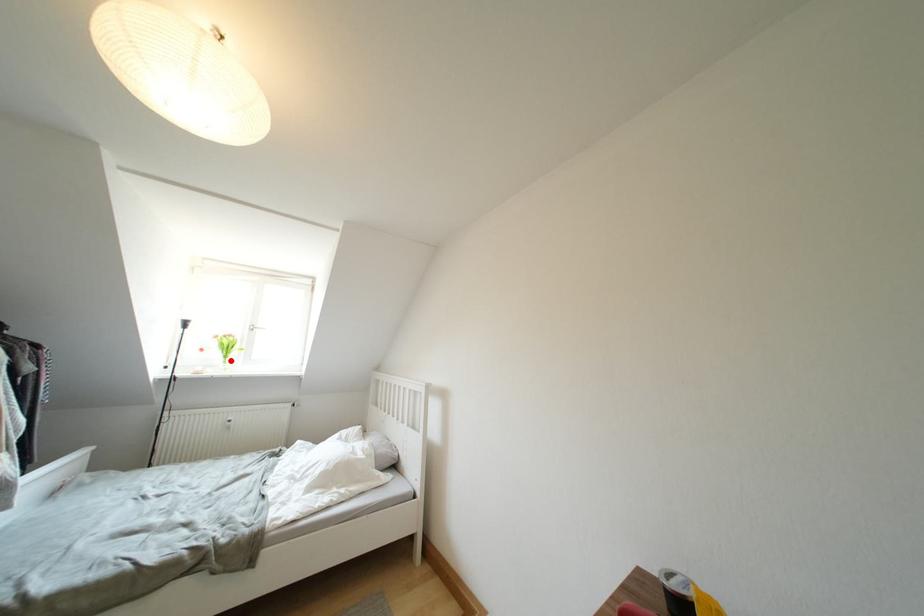
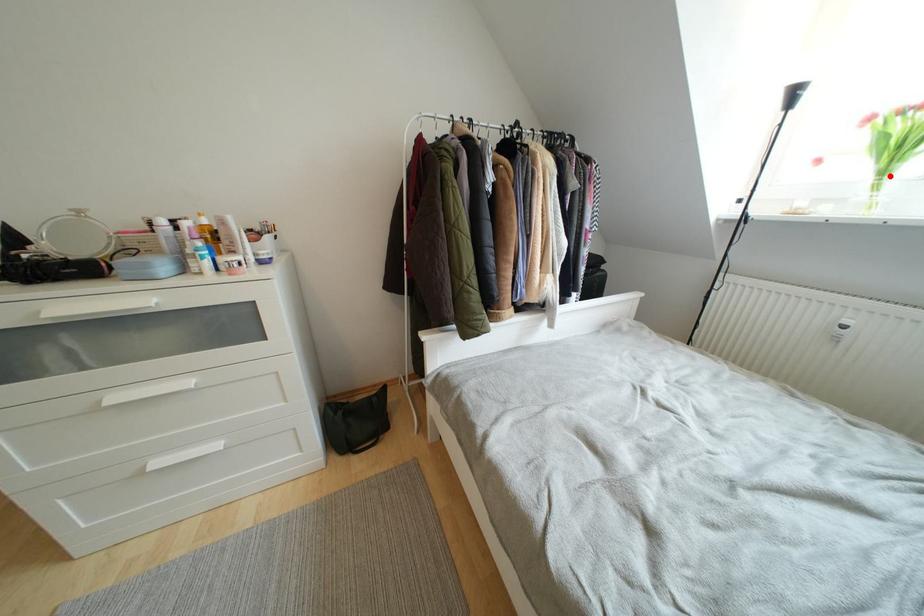
I am providing you with two images of the same scene from different viewpoints. A red point is marked on the first image and another point is marked on the second image. Do the highlighted points in image1 and image2 indicate the same real-world spot?

Yes